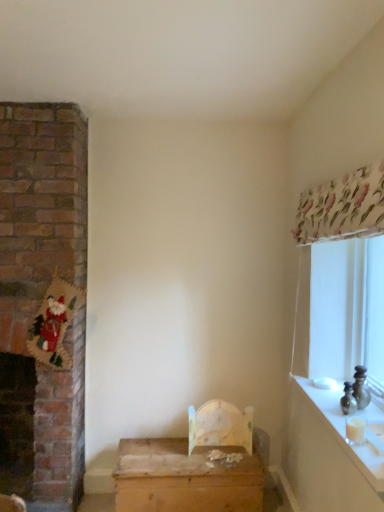
Question: In the image, is white glossy counter top at right positioned in front of or behind wooden chest at center?

Choices:
 (A) behind
 (B) front

Answer: (B)

Question: From the image's perspective, is white glossy counter top at right positioned above or below wooden chest at center?

Choices:
 (A) below
 (B) above

Answer: (B)

Question: Does point (382, 467) appear closer or farther from the camera than point (119, 454)?

Choices:
 (A) closer
 (B) farther

Answer: (A)

Question: Considering the positions of wooden chest at center and white glossy counter top at right in the image, is wooden chest at center wider or thinner than white glossy counter top at right?

Choices:
 (A) wide
 (B) thin

Answer: (A)

Question: Does point (145, 501) appear closer or farther from the camera than point (316, 391)?

Choices:
 (A) farther
 (B) closer

Answer: (A)

Question: In terms of height, does wooden chest at center look taller or shorter compared to white glossy counter top at right?

Choices:
 (A) short
 (B) tall

Answer: (B)

Question: In the image, is wooden chest at center positioned in front of or behind white glossy counter top at right?

Choices:
 (A) front
 (B) behind

Answer: (B)